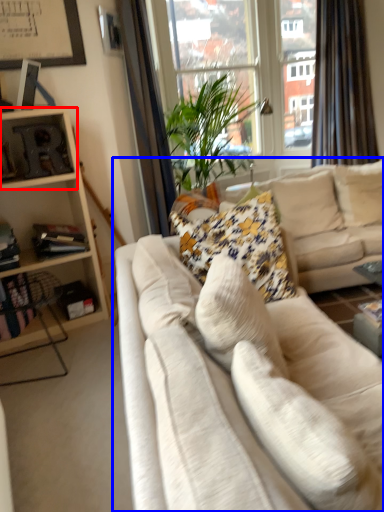
Question: Among these objects, which one is nearest to the camera, shelf (highlighted by a red box) or studio couch (highlighted by a blue box)?

Choices:
 (A) shelf
 (B) studio couch

Answer: (B)